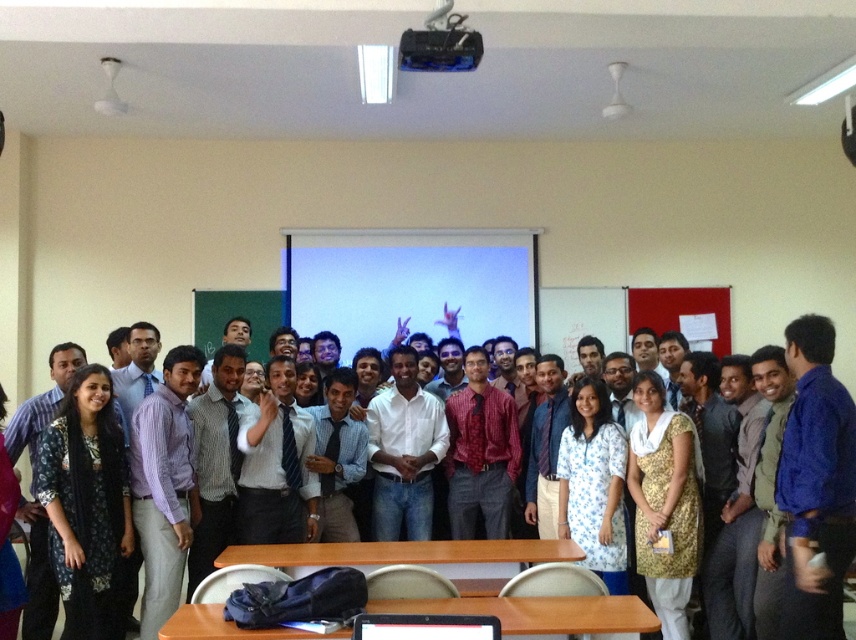
You are standing at the center of the room facing the projection screen. Which object from the following is positioned to your left side? The black fabric dress at left or the red notice board on the right?

The black fabric dress at left is located at point (87, 508), which is to the left side of the room. Since you are facing the projection screen, the black fabric dress at left would be to your left side.

You are a photographer standing at the back of the room. You need to place a 12 cm tall object on either the brown wooden table at center or the black glossy laptop at center. Which surface can accommodate the object without it being too tall?

The brown wooden table at center has a greater height compared to the black glossy laptop at center, so the 12 cm tall object can be placed on the brown wooden table at center since it is taller and provides enough space.